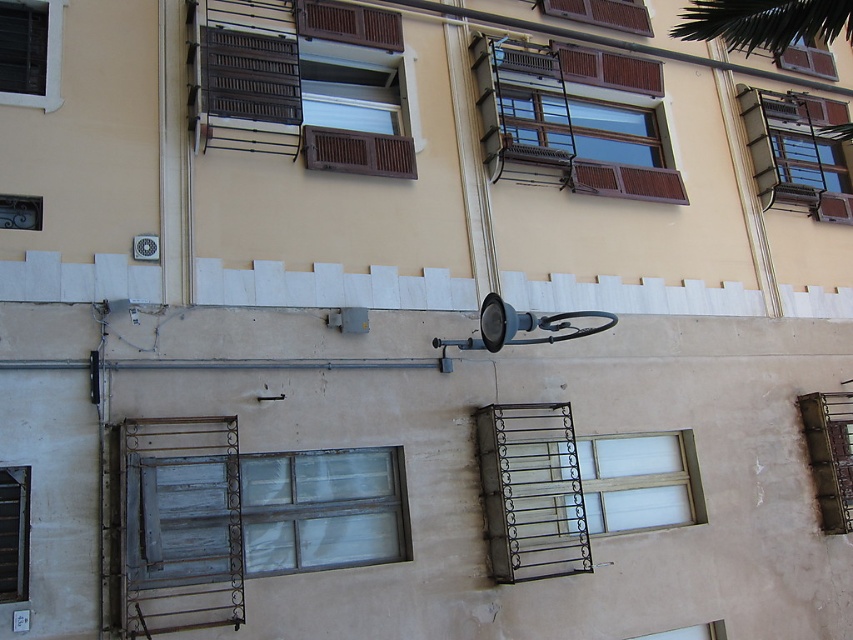
Question: Which point is farther from the camera taking this photo?

Choices:
 (A) (584, 19)
 (B) (824, 208)
 (C) (194, 68)

Answer: (B)

Question: Which of the following is the farthest from the observer?

Choices:
 (A) (22, 106)
 (B) (653, 516)
 (C) (347, 563)
 (D) (601, 1)

Answer: (D)

Question: Which object is the farthest from the rustic metal balcony at upper right?

Choices:
 (A) brown wooden balcony at upper left
 (B) white wooden window at center

Answer: (A)

Question: Can you confirm if white wooden window at center is wider than matte brown window at upper right?

Choices:
 (A) yes
 (B) no

Answer: (A)

Question: Does wooden window at lower left appear on the right side of rustic metal balcony at upper right?

Choices:
 (A) no
 (B) yes

Answer: (A)

Question: Does wooden balcony at upper center lie in front of wooden at upper center?

Choices:
 (A) yes
 (B) no

Answer: (A)